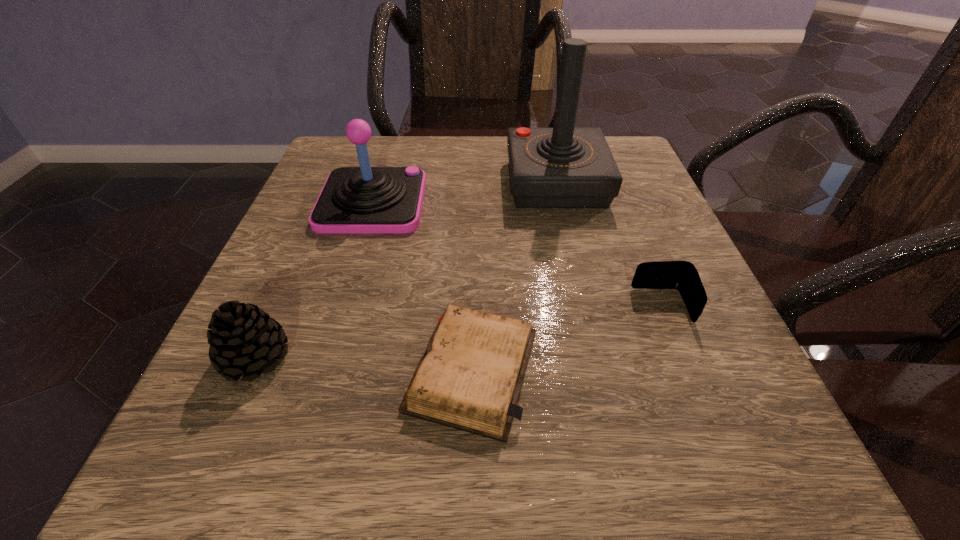
Identify the location of the tallest object. (561, 167).

The height and width of the screenshot is (540, 960). Identify the location of the taller joystick. (561, 167).

Identify the location of the shorter joystick. (354, 200).

You are a GUI agent. You are given a task and a screenshot of the screen. Output one action in this format:
    pyautogui.click(x=<x>, y=<y>)
    Task: Click on the left joystick
    This screenshot has height=540, width=960.
    Given the screenshot: What is the action you would take?
    pyautogui.click(x=354, y=200)

You are a GUI agent. You are given a task and a screenshot of the screen. Output one action in this format:
    pyautogui.click(x=<x>, y=<y>)
    Task: Click on the pinecone
    
    Given the screenshot: What is the action you would take?
    pyautogui.click(x=243, y=339)

The width and height of the screenshot is (960, 540). Identify the location of the fourth tallest object. (682, 275).

You are a GUI agent. You are given a task and a screenshot of the screen. Output one action in this format:
    pyautogui.click(x=<x>, y=<y>)
    Task: Click on the diary
    The height and width of the screenshot is (540, 960).
    Given the screenshot: What is the action you would take?
    pyautogui.click(x=470, y=376)

The width and height of the screenshot is (960, 540). In order to click on vacant area situated 0.130m on the rectangular base of the tallest object in this screenshot , I will do `click(573, 256)`.

You are a GUI agent. You are given a task and a screenshot of the screen. Output one action in this format:
    pyautogui.click(x=<x>, y=<y>)
    Task: Click on the vacant space positioned 0.300m forward from the base of the left joystick
    The height and width of the screenshot is (540, 960).
    Given the screenshot: What is the action you would take?
    pyautogui.click(x=576, y=202)

Where is `vacant point located at the narrow end of the third shortest object`? Image resolution: width=960 pixels, height=540 pixels. vacant point located at the narrow end of the third shortest object is located at coordinates (495, 357).